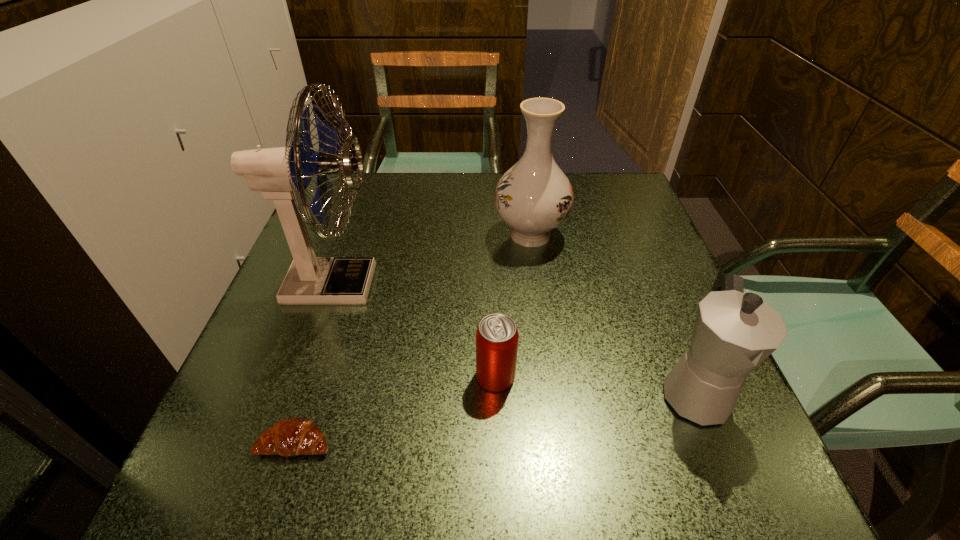
Identify the location of free region located on the right of the shortest object. This screenshot has height=540, width=960. pos(405,442).

Find the location of a particular element. object that is at the far edge is located at coordinates (533, 197).

You are a GUI agent. You are given a task and a screenshot of the screen. Output one action in this format:
    pyautogui.click(x=<x>, y=<y>)
    Task: Click on the object that is at the near edge
    The image size is (960, 540).
    Given the screenshot: What is the action you would take?
    pyautogui.click(x=294, y=436)

This screenshot has height=540, width=960. Find the location of `fan present at the left edge`. fan present at the left edge is located at coordinates (279, 173).

Find the location of a particular element. This screenshot has width=960, height=540. crescent roll that is at the left edge is located at coordinates (294, 436).

You are a GUI agent. You are given a task and a screenshot of the screen. Output one action in this format:
    pyautogui.click(x=<x>, y=<y>)
    Task: Click on the object that is at the right edge
    The height and width of the screenshot is (540, 960).
    Given the screenshot: What is the action you would take?
    pyautogui.click(x=734, y=332)

Locate an element on the screen. Image resolution: width=960 pixels, height=540 pixels. object located at the near left corner is located at coordinates (294, 436).

Locate an element on the screen. free space at the far edge of the desktop is located at coordinates (427, 180).

Where is `vacant space at the left edge of the desktop`? vacant space at the left edge of the desktop is located at coordinates (251, 347).

Identify the location of vacant point at the right edge. The width and height of the screenshot is (960, 540). (674, 295).